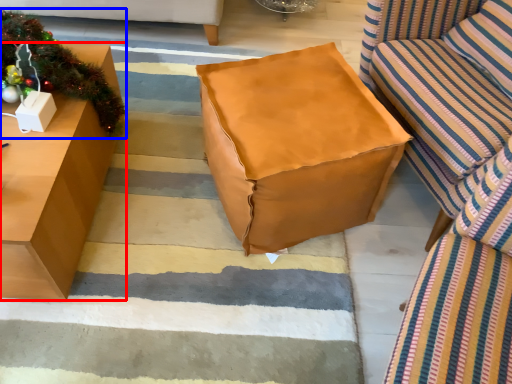
Question: Which point is further to the camera, table (highlighted by a red box) or christmas decoration (highlighted by a blue box)?

Choices:
 (A) table
 (B) christmas decoration

Answer: (B)